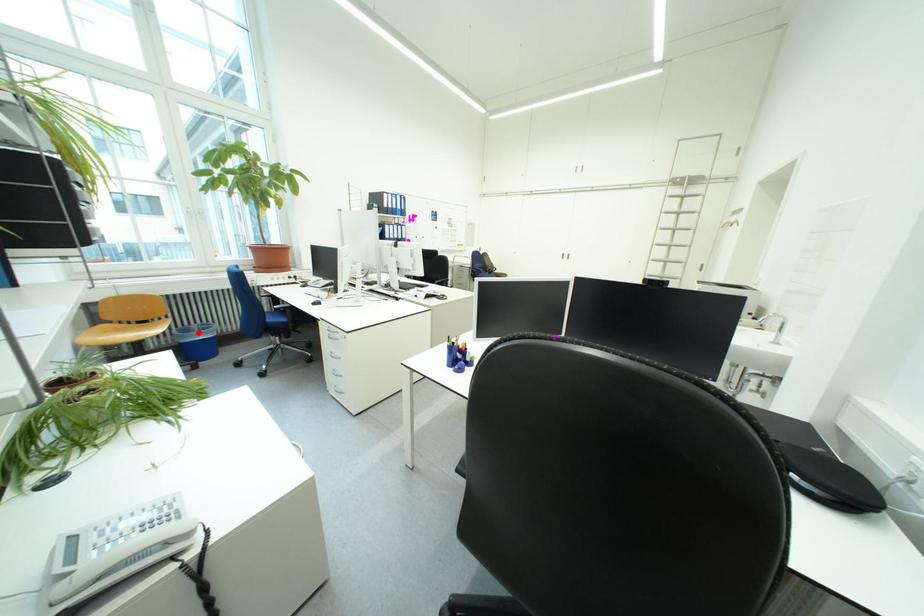
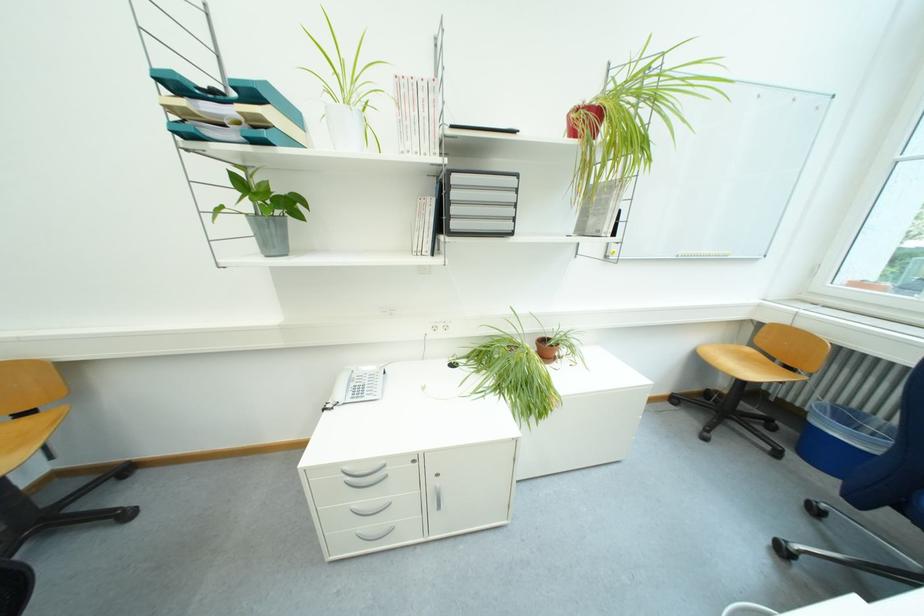
Locate, in the second image, the point that corresponds to the highlighted location in the first image.

(856, 418)